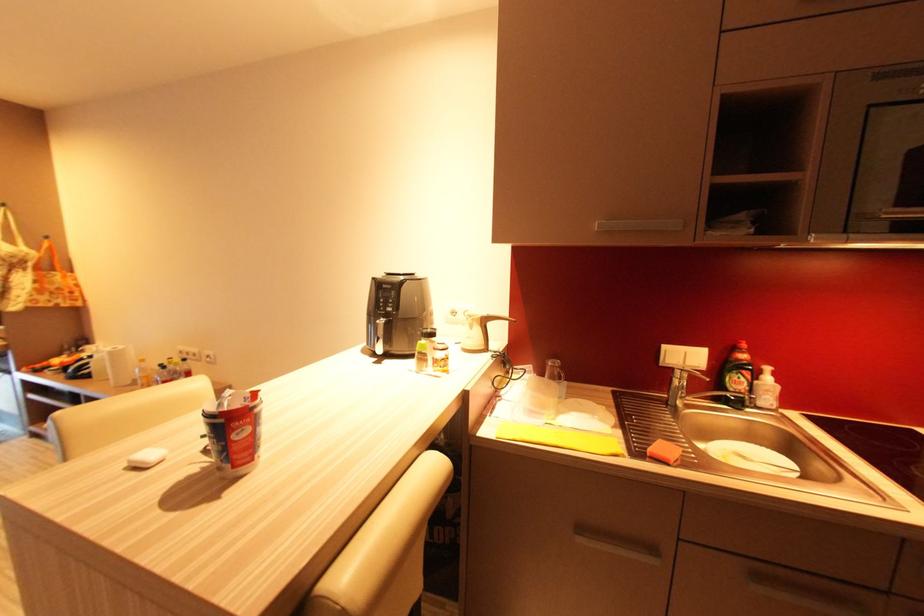
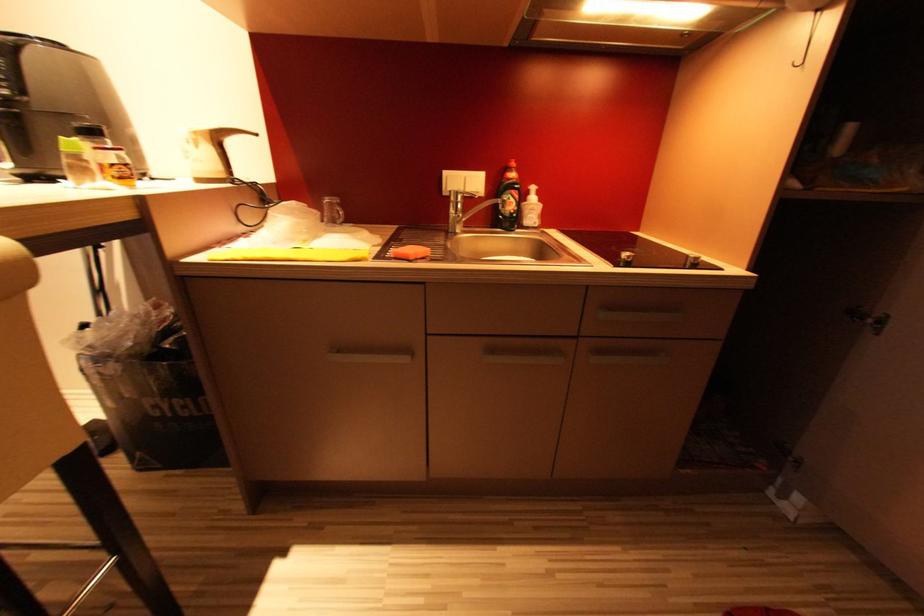
Question: What movement of the cameraman would produce the second image?

Choices:
 (A) Left
 (B) Right
 (C) Forward
 (D) Backward

Answer: (B)